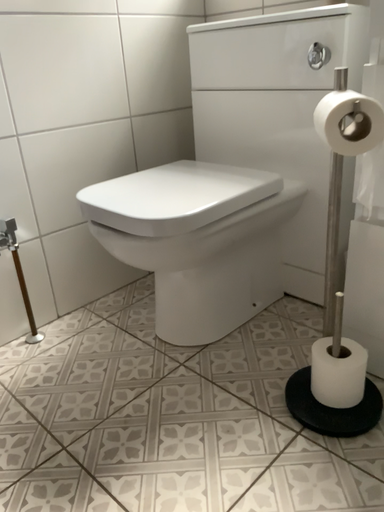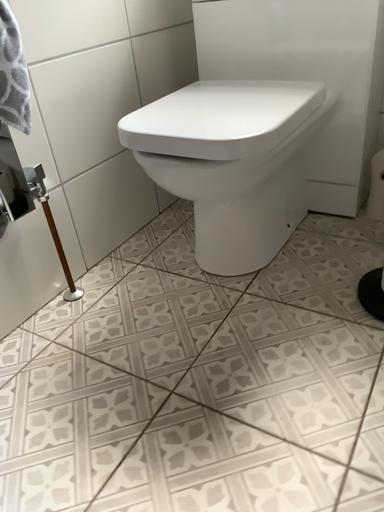
Question: How did the camera likely rotate when shooting the video?

Choices:
 (A) rotated upward
 (B) rotated downward

Answer: (B)